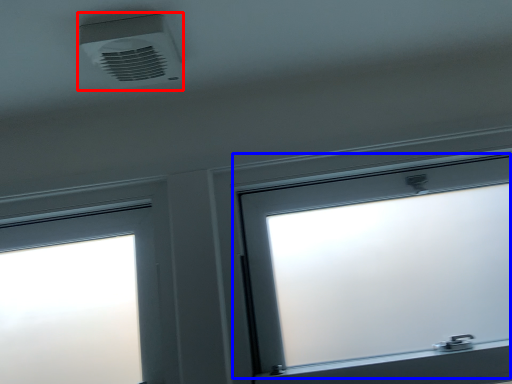
Question: Which object appears closest to the camera in this image, air conditioning (highlighted by a red box) or window (highlighted by a blue box)?

Choices:
 (A) air conditioning
 (B) window

Answer: (A)